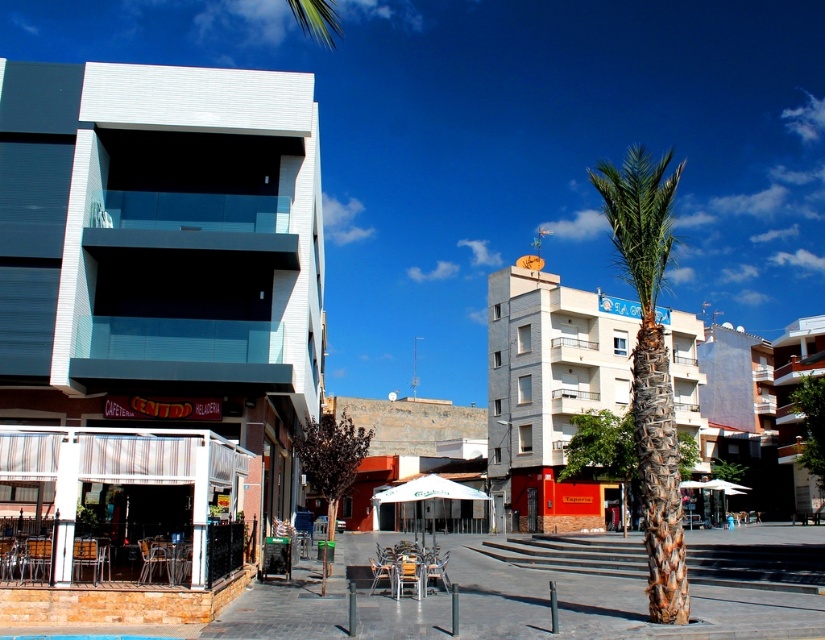
Is white brick building at center behind green textured palm tree at center?

Yes, it is.

Between white brick building at center and green textured palm tree at center, which one is positioned lower?

white brick building at center is below.

Between point (615, 500) and point (640, 436), which one is positioned in front?

Point (640, 436)

The height and width of the screenshot is (640, 825). In order to click on white brick building at center in this screenshot , I will do `click(550, 394)`.

Is white textured building at left closer to the viewer compared to white concrete building at right?

Yes, white textured building at left is closer to the viewer.

Can you confirm if white textured building at left is positioned below white concrete building at right?

No, white textured building at left is not below white concrete building at right.

Describe the element at coordinates (153, 320) in the screenshot. I see `white textured building at left` at that location.

Locate an element on the screen. white textured building at left is located at coordinates (153, 320).

Who is lower down, white textured building at left or white brick building at center?

white brick building at center

Does point (305, 180) lie behind point (555, 305)?

No.

You are a GUI agent. You are given a task and a screenshot of the screen. Output one action in this format:
    pyautogui.click(x=<x>, y=<y>)
    Task: Click on the white textured building at left
    The width and height of the screenshot is (825, 640).
    Given the screenshot: What is the action you would take?
    pyautogui.click(x=153, y=320)